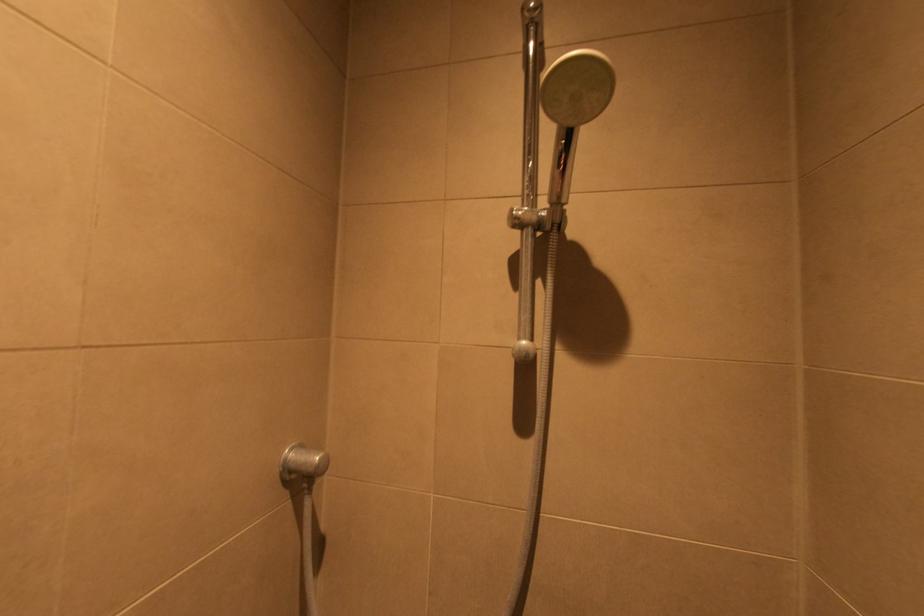
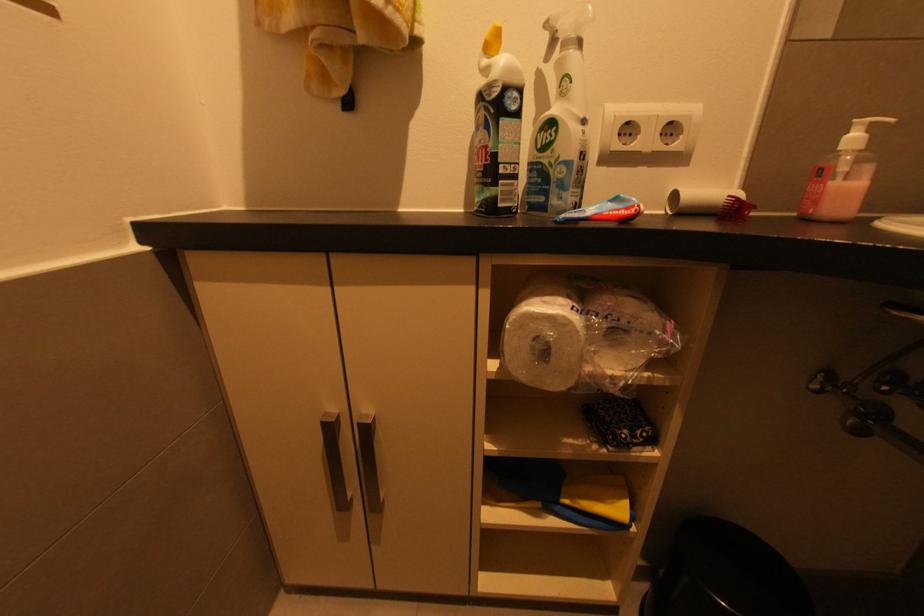
Question: In a continuous first-person perspective shot, in which direction is the camera moving?

Choices:
 (A) Left
 (B) Right
 (C) Forward
 (D) Backward

Answer: (A)